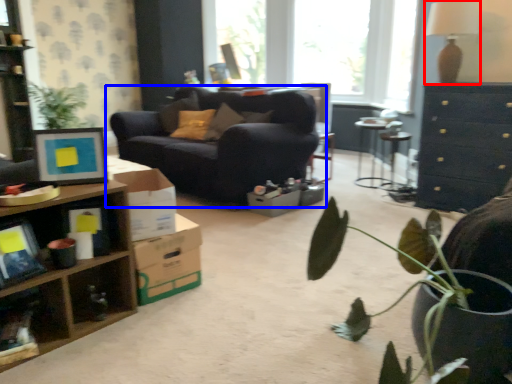
Question: Which point is closer to the camera, lamp (highlighted by a red box) or studio couch (highlighted by a blue box)?

Choices:
 (A) lamp
 (B) studio couch

Answer: (A)